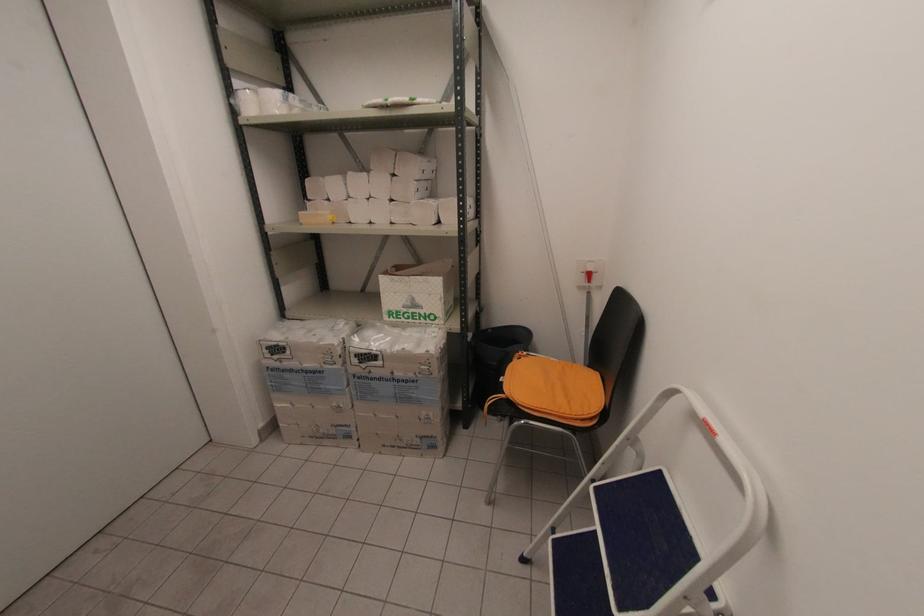
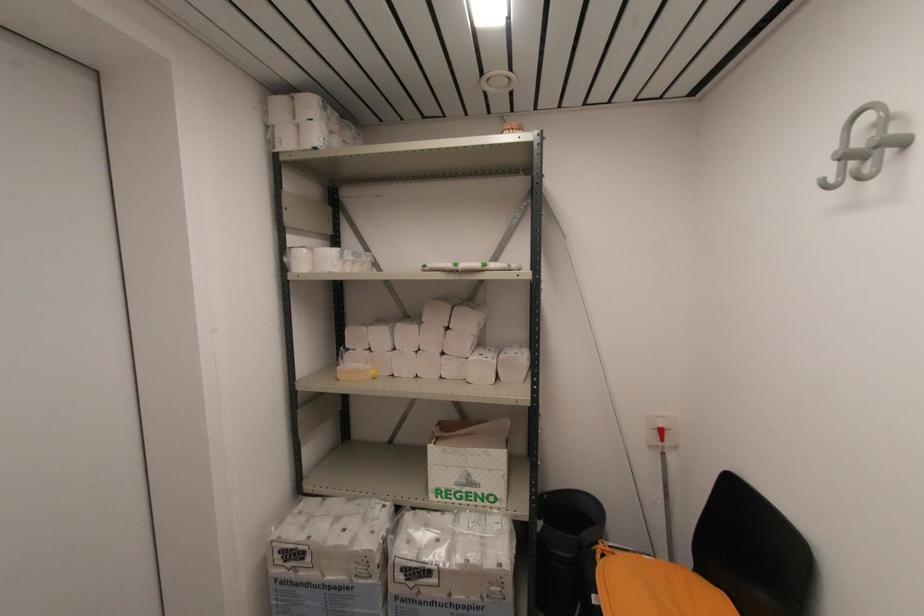
Where in the second image is the point corresponding to (x=590, y=282) from the first image?

(663, 439)